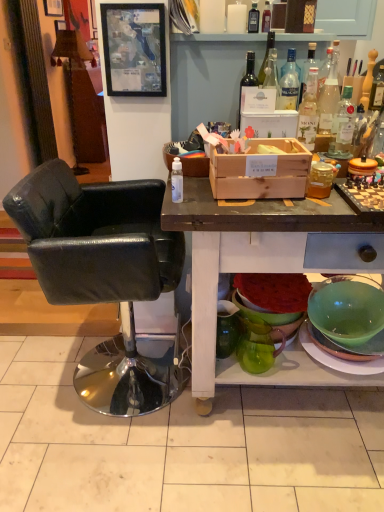
You are a GUI agent. You are given a task and a screenshot of the screen. Output one action in this format:
    pyautogui.click(x=<x>, y=<y>)
    Task: Click on the vacant space underneath black leather chair at left (from a real-world perspective)
    Image resolution: width=384 pixels, height=512 pixels.
    Given the screenshot: What is the action you would take?
    pyautogui.click(x=110, y=380)